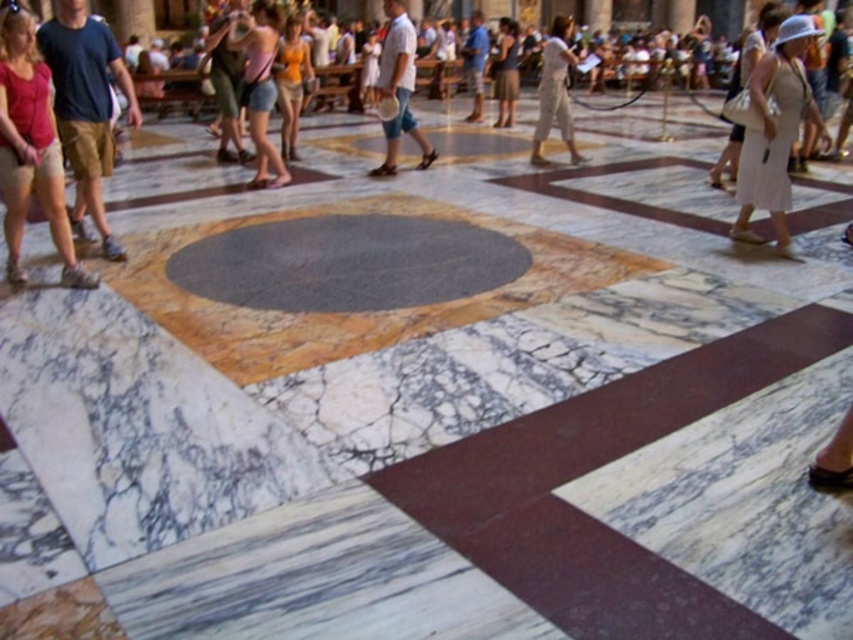
In the scene shown: Is white cotton dress at right below white cotton shirt at center?

Correct, white cotton dress at right is located below white cotton shirt at center.

Is point (770, 168) behind point (405, 120)?

That is False.

Locate an element on the screen. The height and width of the screenshot is (640, 853). white cotton dress at right is located at coordinates (775, 131).

Which is in front, point (410, 54) or point (494, 61)?

Positioned in front is point (410, 54).

Can you confirm if white cotton shirt at center is positioned to the right of dark brown leather jacket at center?

Incorrect, white cotton shirt at center is not on the right side of dark brown leather jacket at center.

Does point (390, 56) lie behind point (515, 97)?

That is False.

Identify the location of white cotton shirt at center. pos(398,88).

Can you confirm if matte pink shorts at center is positioned to the left of white cotton shirt at center?

Correct, you'll find matte pink shorts at center to the left of white cotton shirt at center.

Between point (271, 22) and point (430, 161), which one is positioned behind?

The point (430, 161) is more distant.

Who is more distant from viewer, (277, 166) or (380, 68)?

Point (380, 68)

Find the location of a particular element. Image resolution: width=853 pixels, height=640 pixels. matte pink shorts at center is located at coordinates (260, 88).